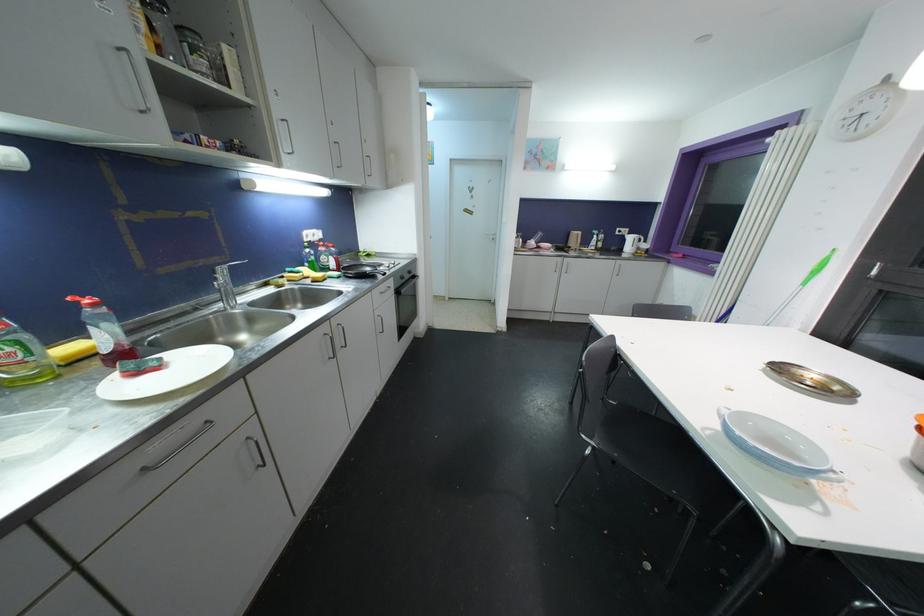
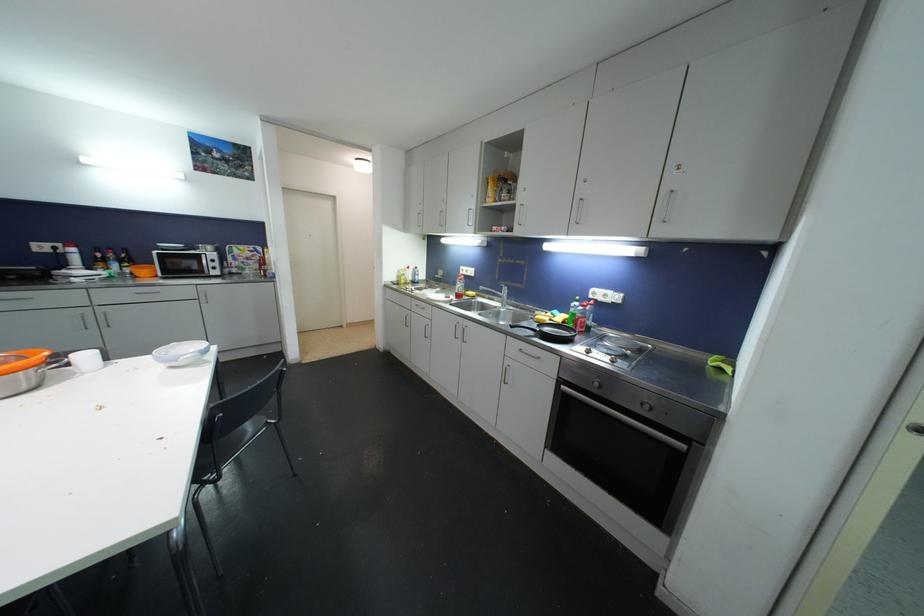
The point at (165, 273) is marked in the first image. Where is the corresponding point in the second image?

(504, 285)